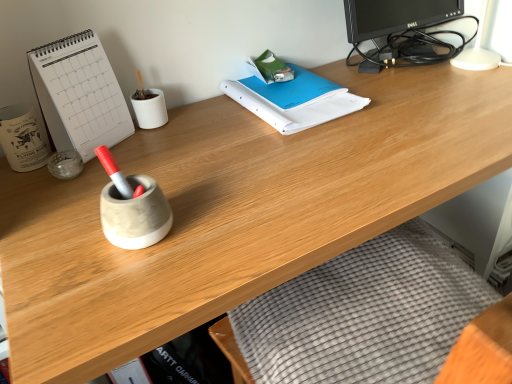
Identify the location of vacant area that lies between blue paper binder at center and white paper at left. The height and width of the screenshot is (384, 512). (196, 135).